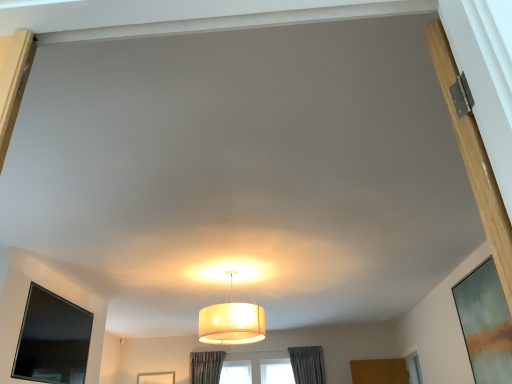
Question: Considering the positions of point (243, 334) and point (483, 375), is point (243, 334) closer or farther from the camera than point (483, 375)?

Choices:
 (A) farther
 (B) closer

Answer: (A)

Question: Is matte white lampshade at center inside the boundaries of matte glass window screen at right, the first window screen viewed from the right, or outside?

Choices:
 (A) outside
 (B) inside

Answer: (A)

Question: Which of these objects is positioned farthest from the matte glass window screen at right, arranged as the second window screen when viewed from the left?

Choices:
 (A) black glossy tv at lower left, which is the second window screen in right-to-left order
 (B) matte white lampshade at center

Answer: (A)

Question: Based on their relative distances, which object is nearer to the matte glass window screen at right, the first window screen viewed from the right?

Choices:
 (A) black glossy tv at lower left, which is the second window screen in right-to-left order
 (B) matte white lampshade at center

Answer: (B)